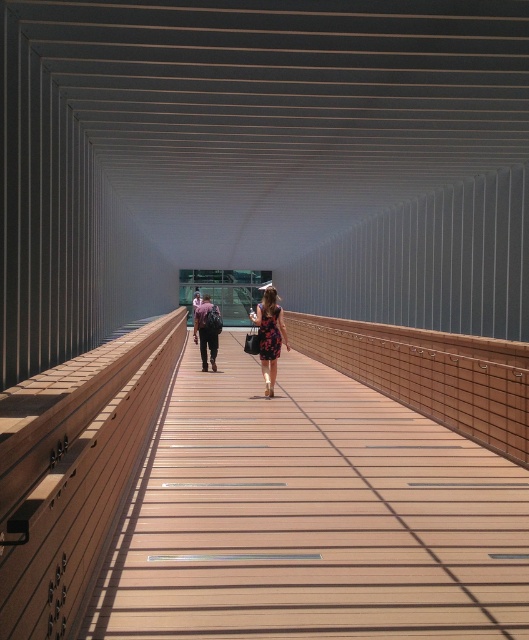
You are standing at the entrance of the brown wooden bridge at center. If you walk straight ahead, will you eventually reach the end of the bridge? Please explain your reasoning based on the bridge design described.

Yes, the brown wooden bridge at center has a structured design with parallel beams running its length, indicating a path that leads to an end. Walking straight ahead would follow this linear structure towards the termination point.